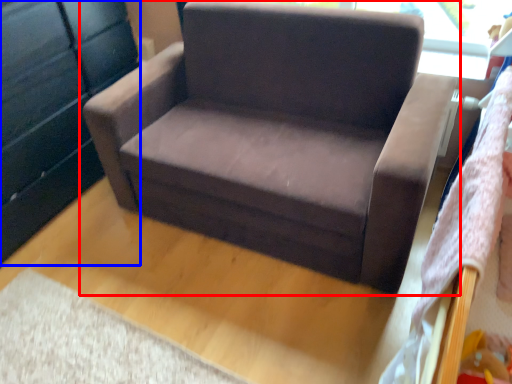
Question: Which object is closer to the camera taking this photo, chair (highlighted by a red box) or dresser (highlighted by a blue box)?

Choices:
 (A) chair
 (B) dresser

Answer: (A)